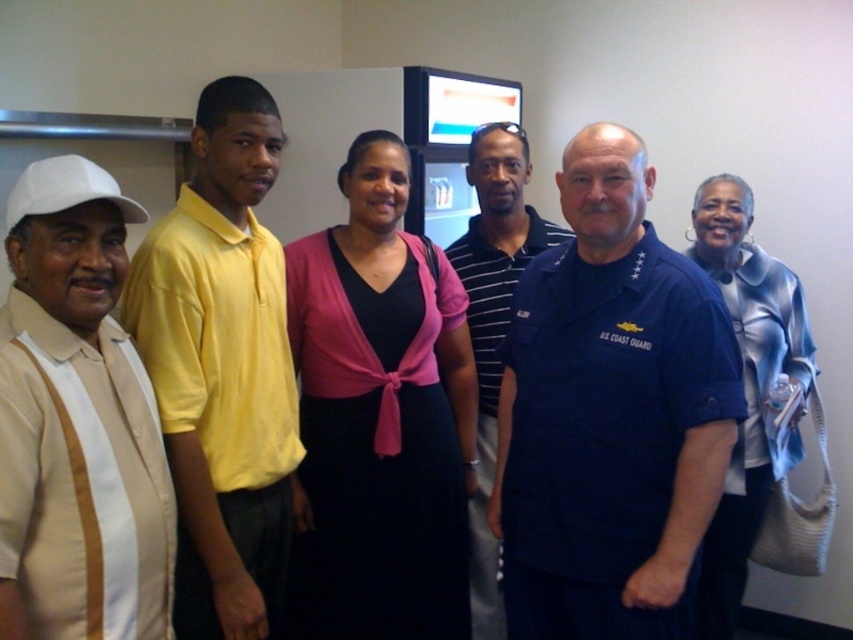
You are organizing a photo shoot and need to arrange the participants based on their clothing colors. The navy blue uniform at center and the beige striped shirt at left are two of the participants. According to the scene description, which participant is positioned lower in the image?

The navy blue uniform at center is positioned lower in the image than the beige striped shirt at left.

You are organizing a clothing donation drive and need to determine which item takes up more space in the donation box. Which between the navy blue uniform at center and the black satin dress at center is larger in size?

The navy blue uniform at center is larger in size compared to the black satin dress at center, so it takes up more space in the donation box.

You are organizing a photo shoot and need to arrange the beige striped shirt at left and the silver metallic jacket at right in a way that balances their visual weight. Considering their sizes, which object should be placed in a larger area to achieve balance?

The silver metallic jacket at right should be placed in a larger area because it occupies more space than the beige striped shirt at left, so balancing their sizes would require the larger object to have a proportionally larger space.